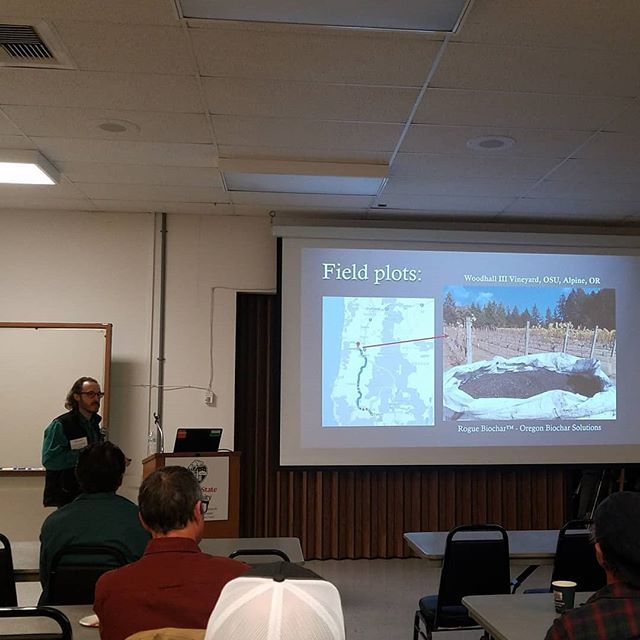
What are the coordinates of `black chair at white table on right side of room - left chair` in the screenshot? It's located at (570, 545).